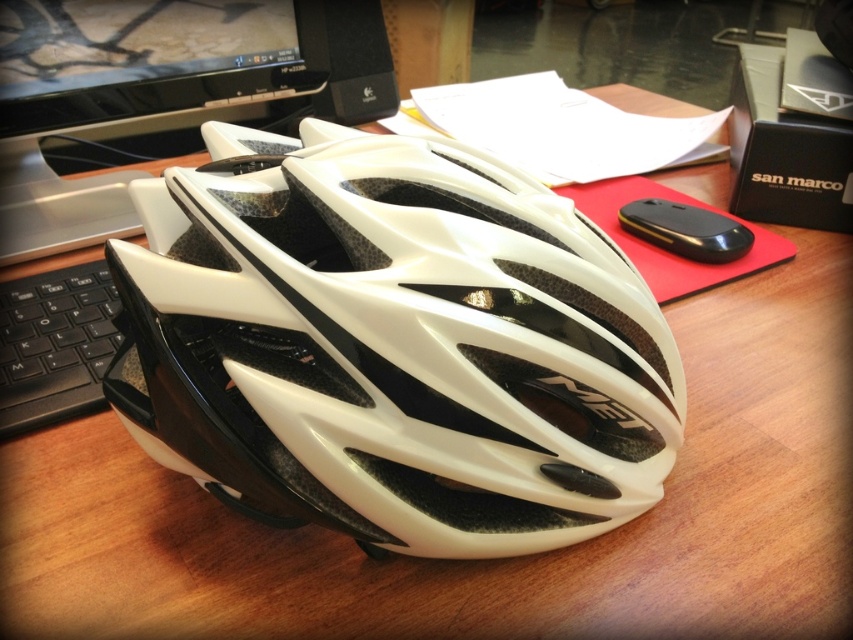
From the picture: Does white matte computer at upper left have a smaller size compared to black plastic keyboard at left?

No.

What do you see at coordinates (112, 93) in the screenshot? I see `white matte computer at upper left` at bounding box center [112, 93].

At what (x,y) coordinates should I click in order to perform the action: click on white matte computer at upper left. Please return your answer as a coordinate pair (x, y). The width and height of the screenshot is (853, 640). Looking at the image, I should click on point(112,93).

Does white matte helmet at center appear on the left side of black plastic keyboard at left?

No, white matte helmet at center is not to the left of black plastic keyboard at left.

Who is more distant from viewer, (434, 323) or (18, 396)?

Point (18, 396)

Does point (469, 307) come farther from viewer compared to point (7, 412)?

No, it is not.

The height and width of the screenshot is (640, 853). I want to click on white matte helmet at center, so click(393, 346).

Does white matte helmet at center have a lesser height compared to white matte computer at upper left?

Indeed, white matte helmet at center has a lesser height compared to white matte computer at upper left.

Is white matte helmet at center wider than white matte computer at upper left?

Correct, the width of white matte helmet at center exceeds that of white matte computer at upper left.

Is point (216, 486) closer to camera compared to point (13, 221)?

Yes, it is in front of point (13, 221).

You are a GUI agent. You are given a task and a screenshot of the screen. Output one action in this format:
    pyautogui.click(x=<x>, y=<y>)
    Task: Click on the white matte helmet at center
    This screenshot has height=640, width=853.
    Given the screenshot: What is the action you would take?
    pyautogui.click(x=393, y=346)